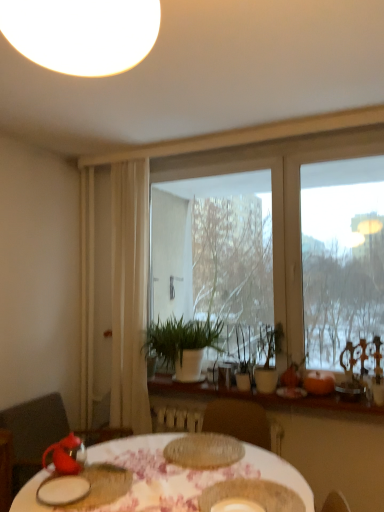
Image resolution: width=384 pixels, height=512 pixels. I want to click on blank space above white sheer curtain at left (from a real-world perspective), so click(129, 149).